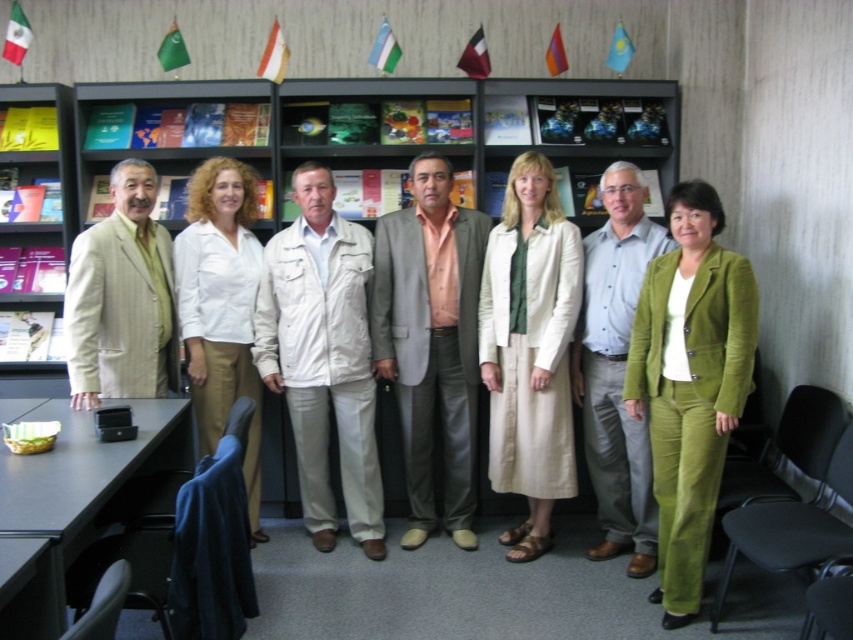
Does green corduroy suit at center appear over light gray suit at center?

Actually, green corduroy suit at center is below light gray suit at center.

Is point (651, 300) positioned behind point (399, 365)?

No, it is not.

Where is `green corduroy suit at center`? green corduroy suit at center is located at coordinates (689, 384).

Who is positioned more to the left, white cotton jacket at center or white cotton blouse at center?

white cotton blouse at center is more to the left.

Does point (376, 472) lie behind point (206, 440)?

Yes, point (376, 472) is farther from viewer.

Who is more forward, (288, 369) or (216, 205)?

Point (288, 369) is more forward.

Image resolution: width=853 pixels, height=640 pixels. What are the coordinates of `white cotton jacket at center` in the screenshot? It's located at (323, 356).

How much distance is there between wooden bookshelf at center and white cotton blouse at center?

wooden bookshelf at center and white cotton blouse at center are 28.93 inches apart.

Is wooden bookshelf at center behind white cotton blouse at center?

Yes.

Where is `wooden bookshelf at center`? The image size is (853, 640). wooden bookshelf at center is located at coordinates (413, 116).